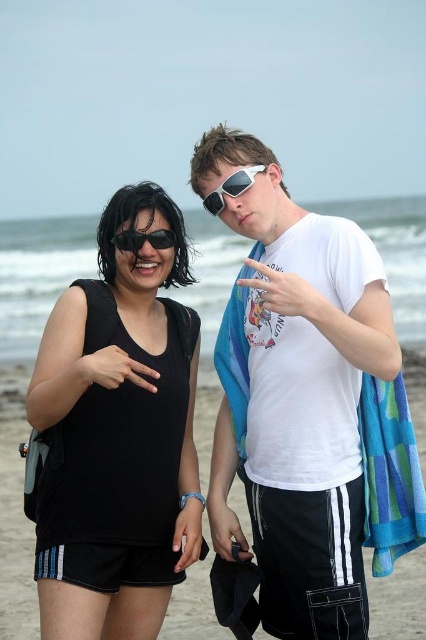
You are a photographer trying to capture a candid shot of the black fabric shorts at lower center and the white plastic sunglasses at upper center. Since you want to focus on the shorts, which object should you ensure is closer to the camera?

The black fabric shorts at lower center is in front of the white plastic sunglasses at upper center, so to focus on the shorts, ensure the black fabric shorts at lower center is closer to the camera.

You are a photographer trying to capture a candid shot of the two people on the beach. The black fabric shorts at lower center and the white plastic sunglasses at upper center are both in your viewfinder. Considering the distance between them, can you estimate whether you can fit both subjects comfortably within a single frame without zooming in?

The distance between the black fabric shorts at lower center and the white plastic sunglasses at upper center is 58.48 feet. Since this distance is quite large, it might be challenging to fit both subjects comfortably within a single frame without zooming in, as they are far apart from each other.

You are standing on the beach and see two points in the image. The first point is at coordinates point (328, 349) and the second is at point (154, 323). Which point is closer to you?

Point (328, 349) is closer to the viewer than point (154, 323).